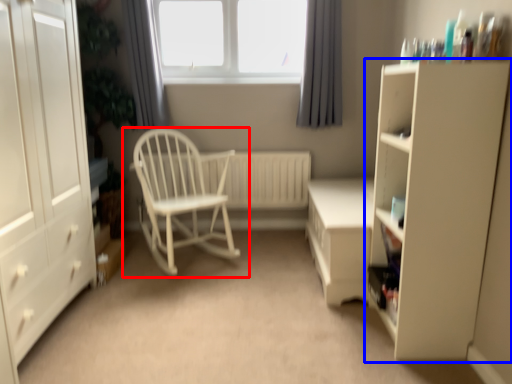
Question: Which of the following is the closest to the observer, chair (highlighted by a red box) or cupboard (highlighted by a blue box)?

Choices:
 (A) chair
 (B) cupboard

Answer: (B)